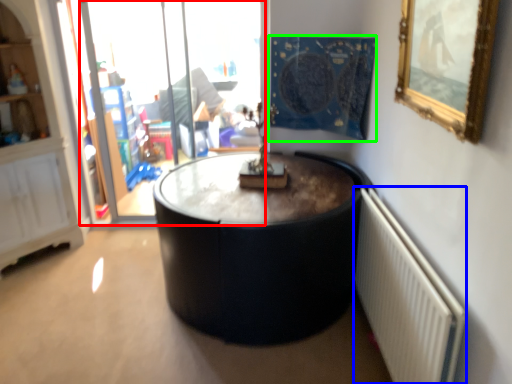
Question: Based on their relative distances, which object is nearer to glass door (highlighted by a red box)? Choose from radiator (highlighted by a blue box) and tapestry (highlighted by a green box).

Choices:
 (A) radiator
 (B) tapestry

Answer: (B)